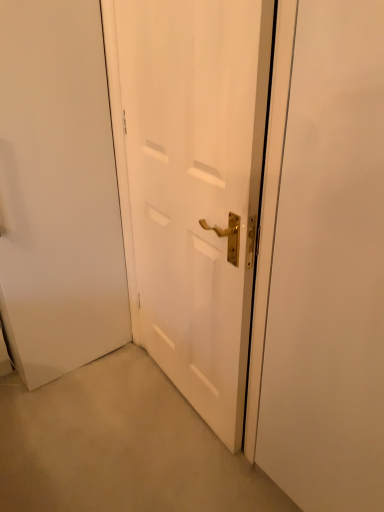
Question: Is white matte door at center turned away from white matte door at center?

Choices:
 (A) no
 (B) yes

Answer: (A)

Question: Considering the relative positions of white matte door at center and white matte door at center in the image provided, is white matte door at center to the left of white matte door at center from the viewer's perspective?

Choices:
 (A) yes
 (B) no

Answer: (B)

Question: Is white matte door at center completely or partially inside white matte door at center?

Choices:
 (A) no
 (B) yes

Answer: (A)

Question: Can you confirm if white matte door at center is wider than white matte door at center?

Choices:
 (A) no
 (B) yes

Answer: (B)

Question: Is white matte door at center at the right side of white matte door at center?

Choices:
 (A) no
 (B) yes

Answer: (B)

Question: Does white matte door at center come in front of white matte door at center?

Choices:
 (A) no
 (B) yes

Answer: (B)

Question: Is white matte door at center positioned in front of white matte door at center?

Choices:
 (A) yes
 (B) no

Answer: (B)

Question: Is white matte door at center not inside white matte door at center?

Choices:
 (A) no
 (B) yes

Answer: (B)

Question: Does white matte door at center have a lesser width compared to white matte door at center?

Choices:
 (A) yes
 (B) no

Answer: (A)

Question: Is white matte door at center at the left side of white matte door at center?

Choices:
 (A) yes
 (B) no

Answer: (A)

Question: Is white matte door at center wider than white matte door at center?

Choices:
 (A) yes
 (B) no

Answer: (B)

Question: Is white matte door at center oriented towards white matte door at center?

Choices:
 (A) yes
 (B) no

Answer: (B)

Question: From a real-world perspective, relative to white matte door at center, is white matte door at center vertically above or below?

Choices:
 (A) above
 (B) below

Answer: (B)